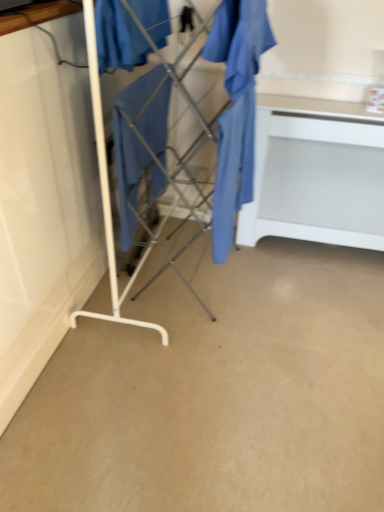
What are the coordinates of `free space in front of metal drying rack at center` in the screenshot? It's located at (185, 343).